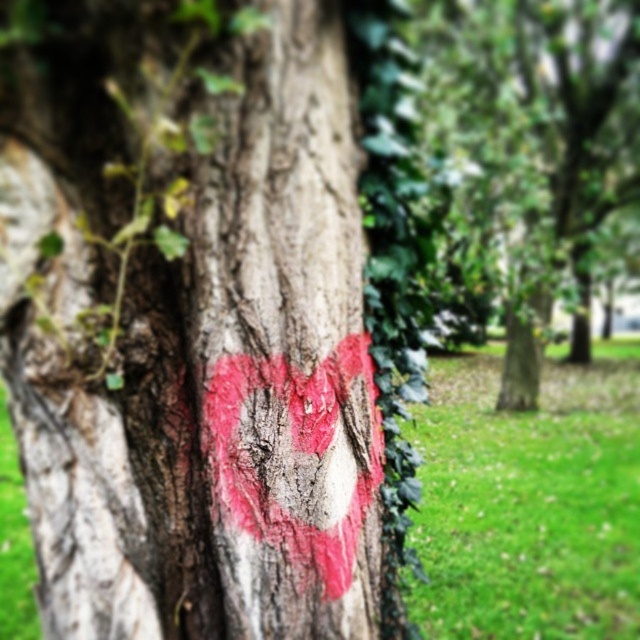
You are a painter who wants to place a new decoration on the tree trunk. You have a sticker that is the same size as the smooth bark tree at center. Can you fit the sticker on the smooth bark heart at center without overlapping the edges?

The smooth bark heart at center is narrower than the smooth bark tree at center. Since the sticker is the same size as the smooth bark tree at center, it will not fit on the smooth bark heart at center without overlapping the edges because the heart is smaller.

You are an artist planning to paint a new symbol on the tree trunk. You want to ensure that the new symbol is larger than the existing smooth bark heart at center but still fits within the boundaries of the smooth bark tree at center. Is this possible based on the current sizes?

The smooth bark heart at center is shorter than the smooth bark tree at center, so yes, it is possible to paint a new symbol larger than the smooth bark heart at center but still within the boundaries of the smooth bark tree at center.